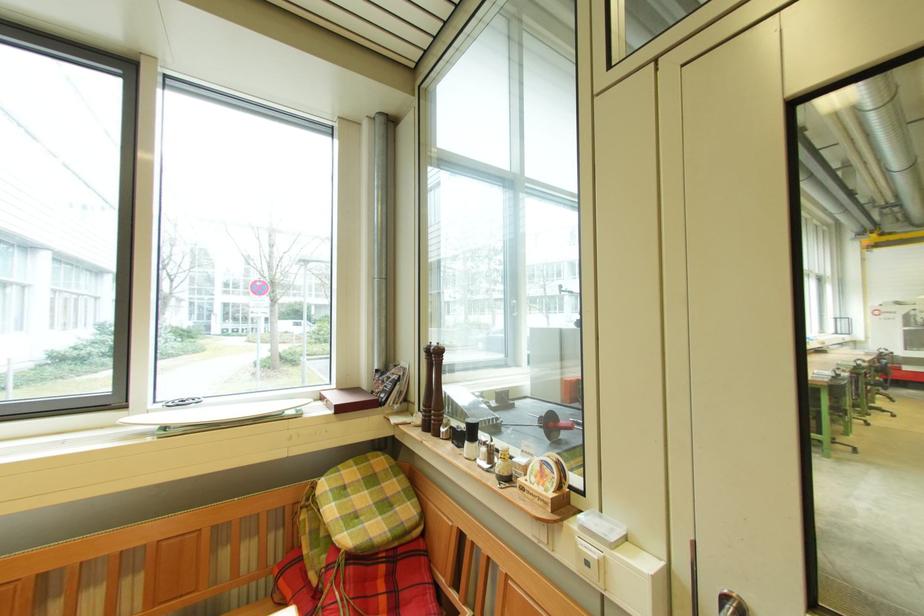
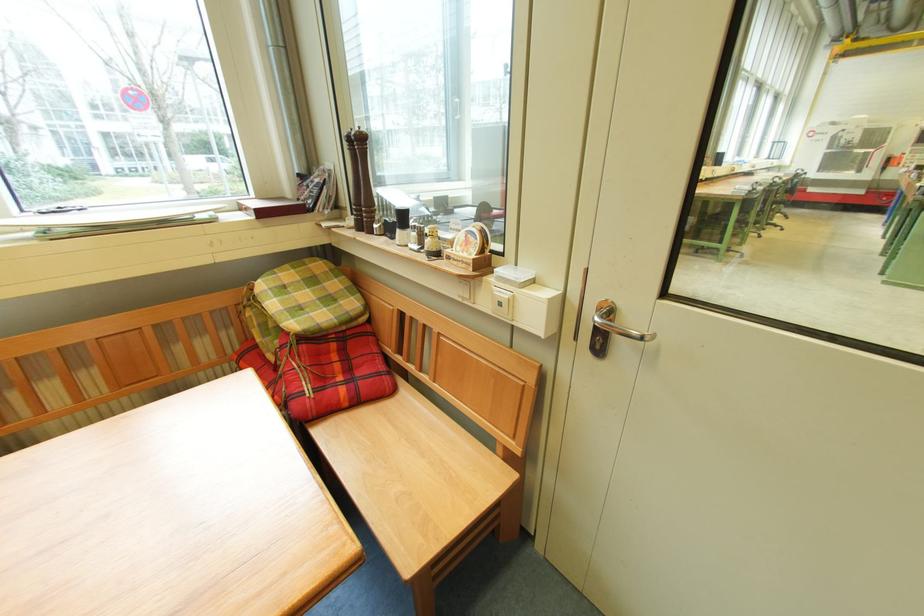
Find the pixel in the second image that matches point 358,464 in the first image.

(295, 268)